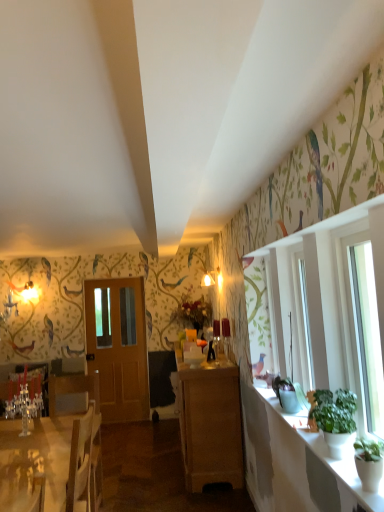
Question: From a real-world perspective, is white glossy desk at lower left on top of green matte plant at right?

Choices:
 (A) no
 (B) yes

Answer: (A)

Question: Is white glossy desk at lower left positioned behind green matte plant at right?

Choices:
 (A) no
 (B) yes

Answer: (B)

Question: Can you confirm if white glossy desk at lower left is smaller than green matte plant at right?

Choices:
 (A) no
 (B) yes

Answer: (A)

Question: From the image's perspective, does white glossy desk at lower left appear lower than green matte plant at right?

Choices:
 (A) no
 (B) yes

Answer: (B)

Question: Is white glossy desk at lower left thinner than green matte plant at right?

Choices:
 (A) yes
 (B) no

Answer: (B)

Question: From the image's perspective, is green matte plant at right above or below wooden armchair at left?

Choices:
 (A) below
 (B) above

Answer: (B)

Question: Is green matte plant at right to the left or to the right of wooden armchair at left in the image?

Choices:
 (A) right
 (B) left

Answer: (A)

Question: Is point click(x=365, y=305) positioned closer to the camera than point click(x=39, y=368)?

Choices:
 (A) closer
 (B) farther

Answer: (A)

Question: Is green matte plant at right inside the boundaries of wooden armchair at left, or outside?

Choices:
 (A) outside
 (B) inside

Answer: (A)

Question: Is point (352, 415) positioned closer to the camera than point (41, 467)?

Choices:
 (A) closer
 (B) farther

Answer: (A)

Question: Which is correct: green leafy plant at right is inside white glossy desk at lower left, or outside of it?

Choices:
 (A) inside
 (B) outside

Answer: (B)

Question: In terms of size, does green leafy plant at right appear bigger or smaller than white glossy desk at lower left?

Choices:
 (A) big
 (B) small

Answer: (B)

Question: Is green leafy plant at right taller or shorter than white glossy desk at lower left?

Choices:
 (A) tall
 (B) short

Answer: (B)

Question: Is green matte plant at right bigger or smaller than white glossy counter top at right?

Choices:
 (A) big
 (B) small

Answer: (A)

Question: Is green matte plant at right spatially inside white glossy counter top at right, or outside of it?

Choices:
 (A) outside
 (B) inside

Answer: (A)